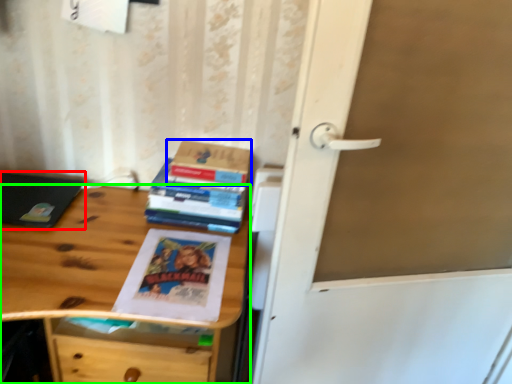
Question: Considering the real-world distances, which object is closest to laptop (highlighted by a red box)? paperback book (highlighted by a blue box) or desk (highlighted by a green box).

Choices:
 (A) paperback book
 (B) desk

Answer: (B)